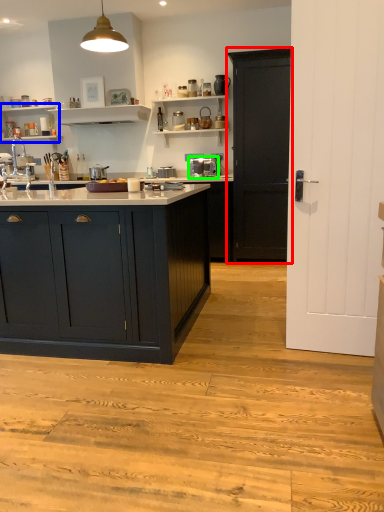
Question: Which is farther away from cabinetry (highlighted by a red box)? shelf (highlighted by a blue box) or coffee machine (highlighted by a green box)?

Choices:
 (A) shelf
 (B) coffee machine

Answer: (A)